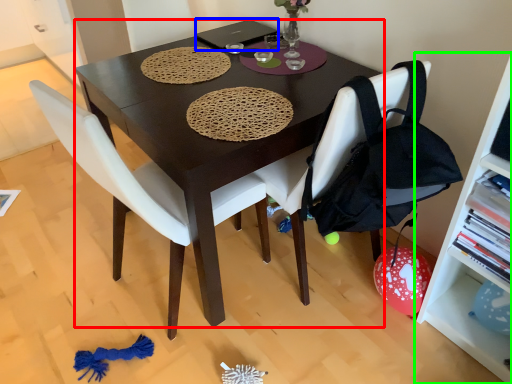
Question: Which object is positioned farthest from desk (highlighted by a red box)? Select from laptop (highlighted by a blue box) and shelf (highlighted by a green box).

Choices:
 (A) laptop
 (B) shelf

Answer: (B)